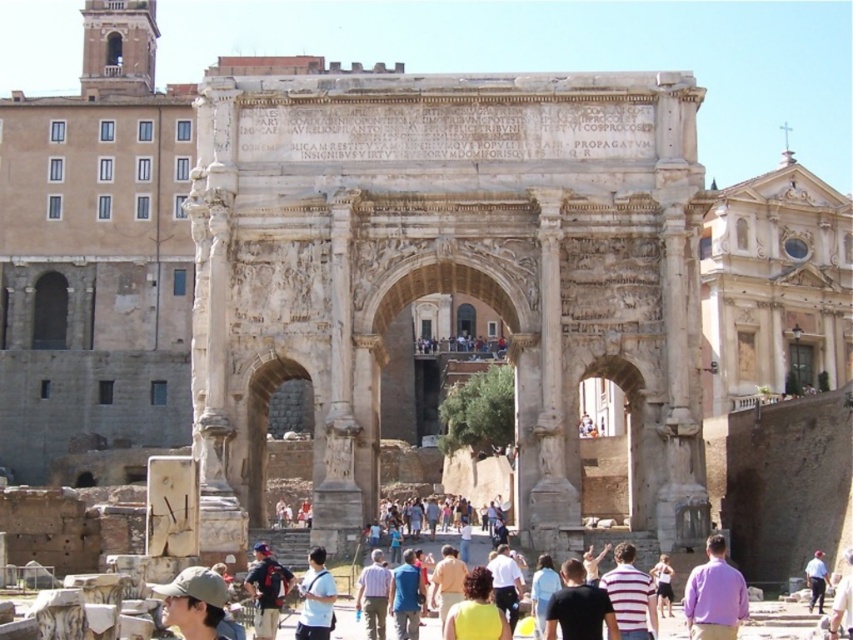
You are standing in front of the Arch of Septimius Severus in Rome. You see a purple cotton shirt at center. Where is the purple cotton shirt located relative to the arch?

The purple cotton shirt at center is located at the center of the image, positioned at coordinates point (x=714, y=595) relative to the arch.